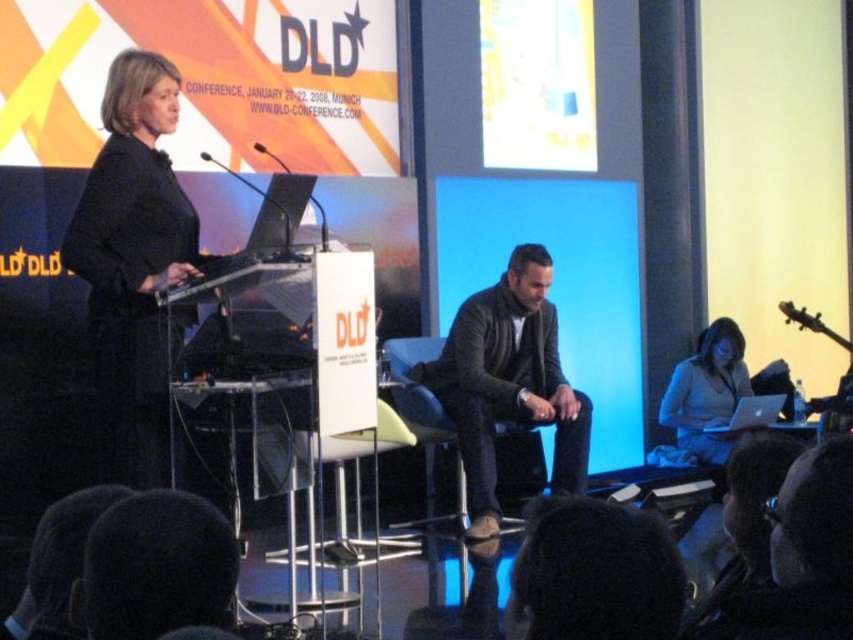
You are an attendee at the DLD Conference in Munich, Germany, and you see the leather jacket at center and the black leather jacket at lower center. Which one is positioned further away from you?

The black leather jacket at lower center is behind leather jacket at center, so it is further away from you.